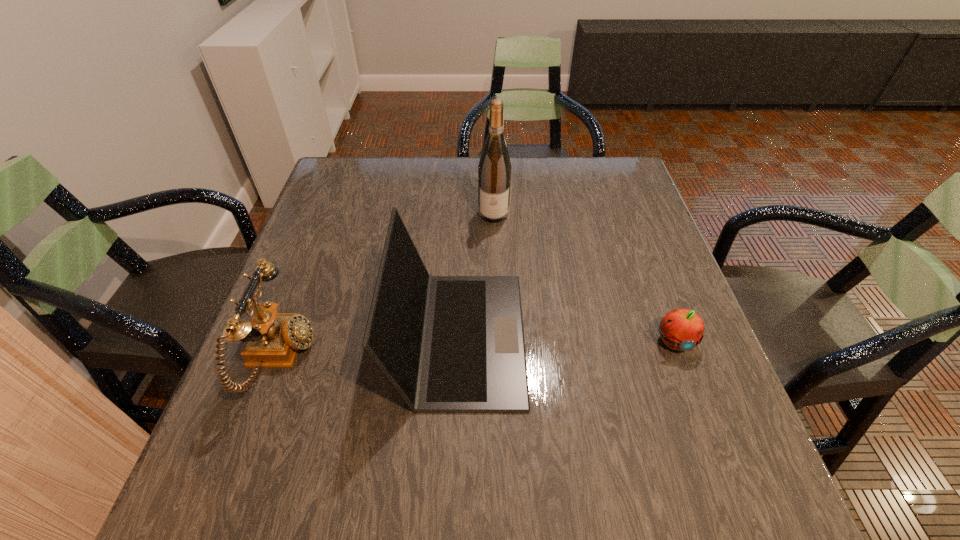
The height and width of the screenshot is (540, 960). In order to click on vacant space that is in between the third shortest object and the wine bottle in this screenshot , I will do `click(476, 275)`.

The width and height of the screenshot is (960, 540). I want to click on vacant area that lies between the third shortest object and the tallest object, so coord(476,275).

Locate an element on the screen. vacant area that lies between the third shortest object and the farthest object is located at coordinates (476, 275).

Locate an element on the screen. vacant point located between the apple and the wine bottle is located at coordinates (584, 277).

Identify which object is located as the nearest to the second shortest object. Please provide its 2D coordinates. Your answer should be formatted as a tuple, i.e. [(x, y)], where the tuple contains the x and y coordinates of a point satisfying the conditions above.

[(446, 343)]

Point out which object is positioned as the third nearest to the second shortest object. Please provide its 2D coordinates. Your answer should be formatted as a tuple, i.e. [(x, y)], where the tuple contains the x and y coordinates of a point satisfying the conditions above.

[(681, 329)]

At what (x,y) coordinates should I click in order to perform the action: click on free spot that satisfies the following two spatial constraints: 1. on the screen of the shortest object; 2. on the left side of the laptop. Please return your answer as a coordinate pair (x, y). This screenshot has height=540, width=960. Looking at the image, I should click on (459, 341).

Locate an element on the screen. free location that satisfies the following two spatial constraints: 1. on the front side of the tallest object; 2. on the screen of the third shortest object is located at coordinates (498, 336).

Where is `vacant region that satisfies the following two spatial constraints: 1. on the screen of the rightmost object; 2. on the right side of the laptop`? This screenshot has width=960, height=540. vacant region that satisfies the following two spatial constraints: 1. on the screen of the rightmost object; 2. on the right side of the laptop is located at coordinates (459, 341).